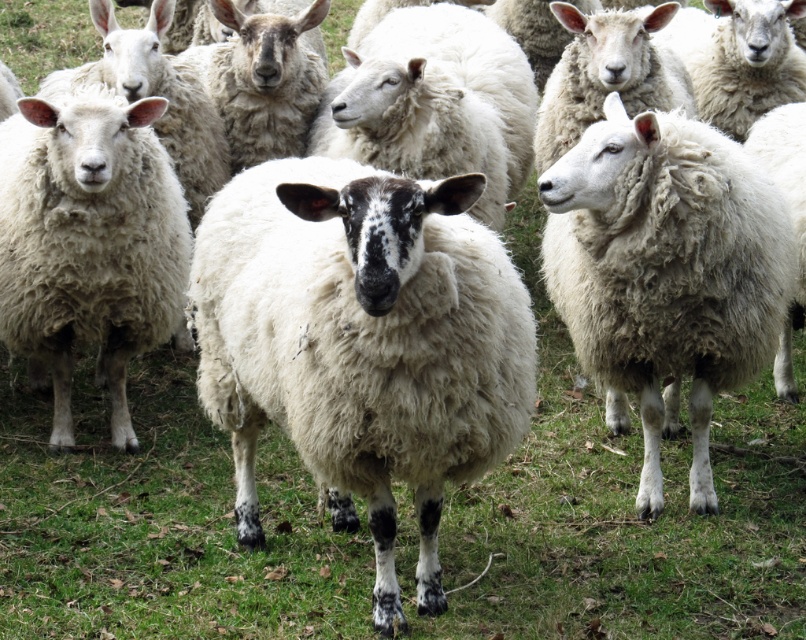
Question: Which point is closer to the camera taking this photo?

Choices:
 (A) (289, 280)
 (B) (2, 321)

Answer: (A)

Question: Which point appears farthest from the camera in this image?

Choices:
 (A) (119, 321)
 (B) (580, 259)
 (C) (368, 218)

Answer: (A)

Question: Is white woolly sheep at right in front of fuzzy white sheep at center?

Choices:
 (A) yes
 (B) no

Answer: (A)

Question: Which point is farther from the camera taking this photo?

Choices:
 (A) (715, 138)
 (B) (335, 205)

Answer: (A)

Question: Does white woolen sheep at center come behind white woolly sheep at right?

Choices:
 (A) yes
 (B) no

Answer: (B)

Question: Where is white woolly sheep at right located in relation to fuzzy white sheep at center in the image?

Choices:
 (A) below
 (B) above

Answer: (A)